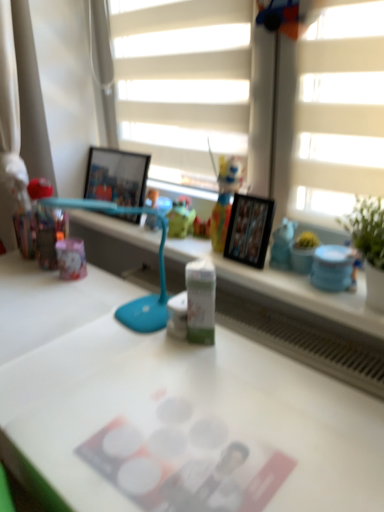
Identify the location of free spot in front of green matte milk carton at center, placed as the 2th stationery when sorted from right to left. (208, 388).